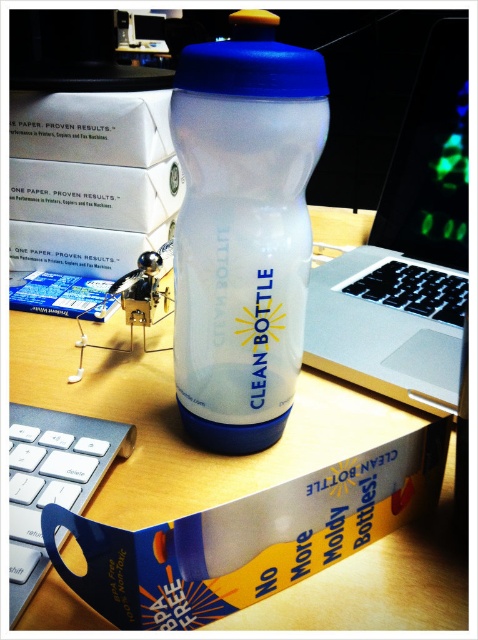
Question: Can you confirm if white matte table at center is positioned to the right of sleek silver laptop at center?

Choices:
 (A) no
 (B) yes

Answer: (A)

Question: Which point is closer to the camera taking this photo?

Choices:
 (A) click(x=101, y=467)
 (B) click(x=306, y=324)

Answer: (A)

Question: In this image, where is white matte table at center located relative to sleek silver laptop at center?

Choices:
 (A) above
 (B) below

Answer: (B)

Question: Which of the following is the farthest from the observer?

Choices:
 (A) pos(66,429)
 (B) pos(225,189)
 (C) pos(443,161)

Answer: (C)

Question: Does transparent plastic bottle at center appear on the right side of white plastic keyboard at lower left?

Choices:
 (A) no
 (B) yes

Answer: (B)

Question: Which of these objects is positioned farthest from the white plastic keyboard at lower left?

Choices:
 (A) sleek silver laptop at center
 (B) transparent plastic bottle at center
 (C) white matte table at center

Answer: (A)